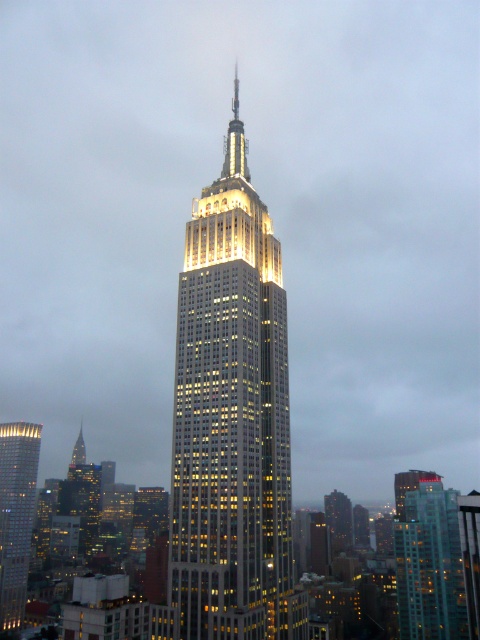
Is teal glass building at center above matte glass skyscraper at left?

Yes, teal glass building at center is above matte glass skyscraper at left.

Does teal glass building at center have a greater width compared to matte glass skyscraper at left?

Correct, the width of teal glass building at center exceeds that of matte glass skyscraper at left.

Is point (427, 540) farther from viewer compared to point (8, 536)?

No, it is not.

Where is `teal glass building at center`? The width and height of the screenshot is (480, 640). teal glass building at center is located at coordinates (428, 557).

Can you confirm if illuminated glass skyscraper at center is thinner than teal glass building at center?

Correct, illuminated glass skyscraper at center's width is less than teal glass building at center's.

Who is more distant from viewer, (200, 324) or (411, 573)?

The point (411, 573) is more distant.

Where is `illuminated glass skyscraper at center`? This screenshot has width=480, height=640. illuminated glass skyscraper at center is located at coordinates (231, 420).

How far apart are illuminated glass skyscraper at center and matte glass skyscraper at left?

A distance of 245.95 meters exists between illuminated glass skyscraper at center and matte glass skyscraper at left.

Does illuminated glass skyscraper at center have a lesser height compared to matte glass skyscraper at left?

No, illuminated glass skyscraper at center is not shorter than matte glass skyscraper at left.

Is point (202, 355) less distant than point (29, 538)?

Yes, point (202, 355) is in front of point (29, 538).

Where is `illuminated glass skyscraper at center`? illuminated glass skyscraper at center is located at coordinates (231, 420).